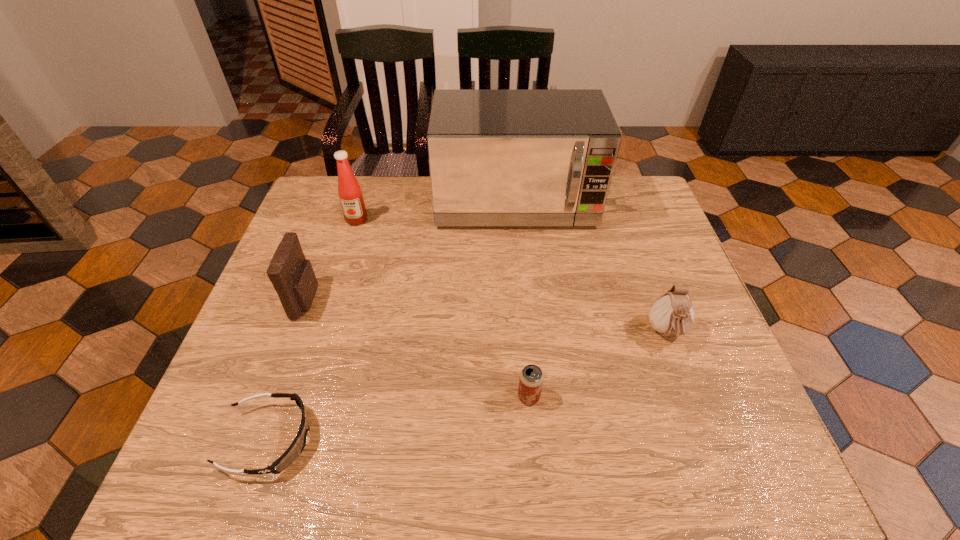
Where is `free space that satisfies the following two spatial constraints: 1. with the door open on the microwave oven; 2. with an open flap on the taller pouch`? The height and width of the screenshot is (540, 960). free space that satisfies the following two spatial constraints: 1. with the door open on the microwave oven; 2. with an open flap on the taller pouch is located at coordinates (524, 300).

This screenshot has height=540, width=960. Identify the location of vacant point that satisfies the following two spatial constraints: 1. on the front-facing side of the fifth tallest object; 2. on the right side of the second tallest object. (302, 396).

Find the location of a particular element. vacant space that satisfies the following two spatial constraints: 1. with the door open on the microwave oven; 2. on the front and sides of the goggles is located at coordinates tap(538, 439).

Find the location of a particular element. This screenshot has height=540, width=960. vacant region that satisfies the following two spatial constraints: 1. with an open flap on the beer can; 2. on the left side of the left pouch is located at coordinates (273, 396).

Identify the location of free space that satisfies the following two spatial constraints: 1. on the front-facing side of the condiment; 2. on the front and sides of the goggles. Image resolution: width=960 pixels, height=540 pixels. (289, 439).